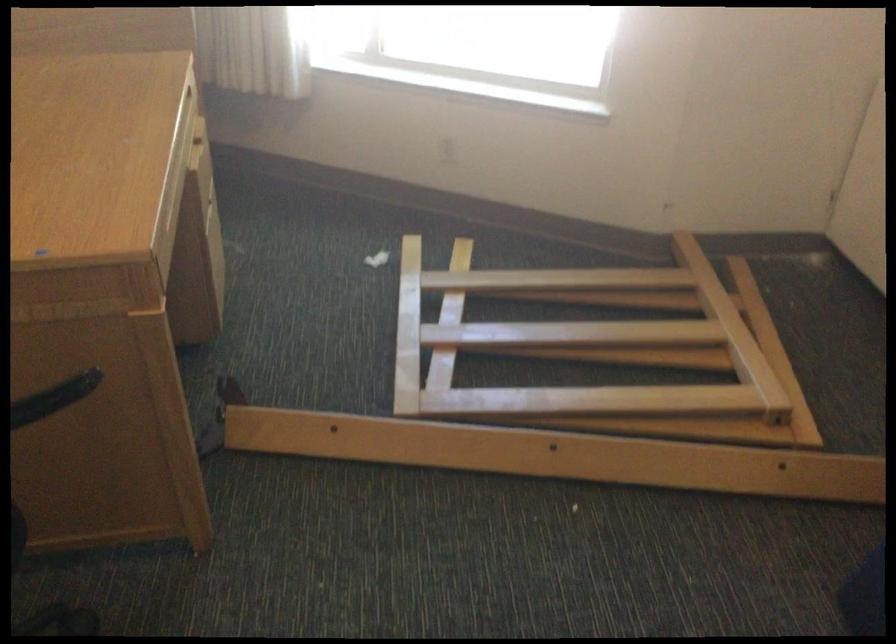
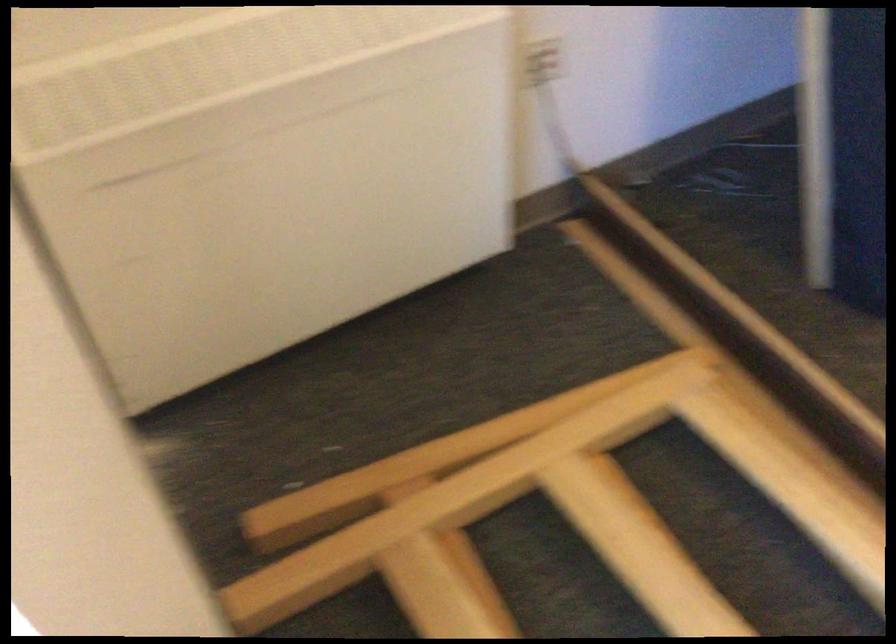
Where in the second image is the point corresponding to pixel 700 243 from the first image?

(313, 545)